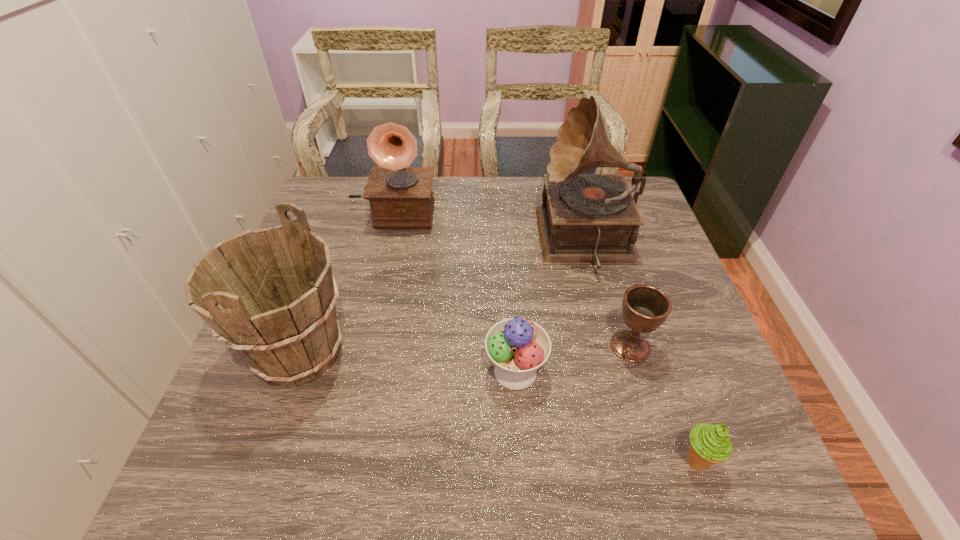
Where is `free spot located 0.060m from the horn of the tallest object`? free spot located 0.060m from the horn of the tallest object is located at coordinates (518, 241).

At what (x,y) coordinates should I click in order to perform the action: click on vacant region located 0.380m from the horn of the tallest object. Please return your answer as a coordinate pair (x, y). Looking at the image, I should click on (407, 241).

Find the location of a particular element. free space located on the horn of the shorter record player is located at coordinates (370, 315).

This screenshot has width=960, height=540. I want to click on free spot located 0.120m on the back of the bucket, so click(x=327, y=276).

Find the location of a particular element. This screenshot has height=540, width=960. free space located 0.360m on the left of the farther icecream is located at coordinates (319, 371).

Image resolution: width=960 pixels, height=540 pixels. In order to click on free space located on the back of the chalice in this screenshot , I will do `click(596, 231)`.

Identify the location of free space located on the left of the nearest object. (596, 461).

This screenshot has height=540, width=960. Find the location of `object at the near edge`. object at the near edge is located at coordinates click(x=710, y=444).

You are a GUI agent. You are given a task and a screenshot of the screen. Output one action in this format:
    pyautogui.click(x=<x>, y=<y>)
    Task: Click on the record player that is at the left edge
    
    Given the screenshot: What is the action you would take?
    pyautogui.click(x=400, y=196)

Where is `bucket present at the left edge`? Image resolution: width=960 pixels, height=540 pixels. bucket present at the left edge is located at coordinates (270, 294).